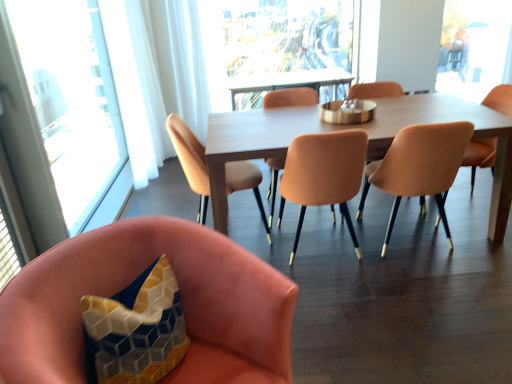
Describe the element at coordinates (71, 99) in the screenshot. I see `transparent glass window at left, the first window from the left` at that location.

What do you see at coordinates (190, 160) in the screenshot? The width and height of the screenshot is (512, 384). I see `matte peach chair at center, the 5th chair when ordered from right to left` at bounding box center [190, 160].

This screenshot has height=384, width=512. What do you see at coordinates (474, 47) in the screenshot? I see `transparent glass window screen at upper right` at bounding box center [474, 47].

Locate an element on the screen. The image size is (512, 384). matte orange chair at center, which is counted as the 3th chair, starting from the left is located at coordinates (291, 98).

At what (x,y) coordinates should I click in order to perform the action: click on transparent glass window at center, which is the 1th window in right-to-left order. Please return your answer as a coordinate pair (x, y). Image resolution: width=512 pixels, height=384 pixels. Looking at the image, I should click on (271, 43).

Image resolution: width=512 pixels, height=384 pixels. I want to click on matte peach armchair at center, so click(x=375, y=90).

Identify the location of transparent glass window at left, positioned as the 2th window in right-to-left order. (71, 99).

Can you tell me how much matte peach chair at center, the 6th chair viewed from the left, and matte peach chair at center, the 5th chair when ordered from right to left, differ in facing direction?

180 degrees.

Would you say matte peach chair at center, which ranks as the 1th chair in right-to-left order, contains matte peach chair at center, the 5th chair when ordered from right to left?

No, matte peach chair at center, which ranks as the 1th chair in right-to-left order, does not contain matte peach chair at center, the 5th chair when ordered from right to left.

Are matte peach chair at center, the 6th chair viewed from the left, and matte peach chair at center, the 5th chair when ordered from right to left, beside each other?

No, matte peach chair at center, the 6th chair viewed from the left, is not beside matte peach chair at center, the 5th chair when ordered from right to left.

Is matte orange chair at center, which appears as the third chair when viewed from the right, with matte orange chair at center, the 4th chair in the right-to-left sequence?

No, matte orange chair at center, which appears as the third chair when viewed from the right, is not in contact with matte orange chair at center, the 4th chair in the right-to-left sequence.

Consider the image. From the image's perspective, is matte orange chair at center, which appears as the third chair when viewed from the right, under matte orange chair at center, which is counted as the 3th chair, starting from the left?

Yes, from the image's perspective, matte orange chair at center, which appears as the third chair when viewed from the right, is below matte orange chair at center, which is counted as the 3th chair, starting from the left.

Between point (347, 161) and point (281, 217), which one is positioned behind?

The point (281, 217) is more distant.

From their relative heights in the image, would you say matte orange chair at center, which appears as the third chair when viewed from the right, is taller or shorter than matte orange chair at center, which is counted as the 3th chair, starting from the left?

Considering their sizes, matte orange chair at center, which appears as the third chair when viewed from the right, has less height than matte orange chair at center, which is counted as the 3th chair, starting from the left.

Can you confirm if transparent glass window screen at upper right is thinner than transparent glass window at center, which ranks as the 2th window in front-to-back order?

Correct, the width of transparent glass window screen at upper right is less than that of transparent glass window at center, which ranks as the 2th window in front-to-back order.

Is point (455, 1) closer to viewer compared to point (261, 77)?

No.

Can you confirm if transparent glass window screen at upper right is positioned to the right of transparent glass window at center, the first window in the back-to-front sequence?

Yes, transparent glass window screen at upper right is to the right of transparent glass window at center, the first window in the back-to-front sequence.

From a real-world perspective, who is located higher, transparent glass window screen at upper right or transparent glass window at center, which ranks as the 2th window in front-to-back order?

From a 3D spatial view, transparent glass window at center, which ranks as the 2th window in front-to-back order, is above.

From a real-world perspective, between matte peach chair at center, which ranks as the 1th chair in right-to-left order, and transparent glass window at center, the first window in the back-to-front sequence, who is vertically lower?

matte peach chair at center, which ranks as the 1th chair in right-to-left order, is physically lower.

Is matte peach chair at center, which ranks as the 1th chair in right-to-left order, outside of transparent glass window at center, the first window in the back-to-front sequence?

Yes, matte peach chair at center, which ranks as the 1th chair in right-to-left order, is outside of transparent glass window at center, the first window in the back-to-front sequence.

Can you confirm if matte peach chair at center, which ranks as the 1th chair in right-to-left order, is smaller than transparent glass window at center, the first window in the back-to-front sequence?

Indeed, matte peach chair at center, which ranks as the 1th chair in right-to-left order, has a smaller size compared to transparent glass window at center, the first window in the back-to-front sequence.

Does matte orange chair at center, which appears as the second chair when viewed from the right, have a lesser width compared to light brown wooden table at center?

Correct, the width of matte orange chair at center, which appears as the second chair when viewed from the right, is less than that of light brown wooden table at center.

From the picture: Which is more to the left, matte orange chair at center, which appears as the second chair when viewed from the right, or light brown wooden table at center?

light brown wooden table at center is more to the left.

Can we say matte orange chair at center, which appears as the second chair when viewed from the right, lies outside light brown wooden table at center?

That's incorrect, matte orange chair at center, which appears as the second chair when viewed from the right, is not completely outside light brown wooden table at center.

Considering the sizes of objects matte orange chair at center, the 4th chair positioned from the left, and matte orange chair at center, which is counted as the fifth chair, starting from the left, in the image provided, who is wider, matte orange chair at center, the 4th chair positioned from the left, or matte orange chair at center, which is counted as the fifth chair, starting from the left,?

matte orange chair at center, the 4th chair positioned from the left.

In terms of size, does matte orange chair at center, which appears as the third chair when viewed from the right, appear bigger or smaller than matte orange chair at center, which is counted as the fifth chair, starting from the left?

Considering their sizes, matte orange chair at center, which appears as the third chair when viewed from the right, takes up less space than matte orange chair at center, which is counted as the fifth chair, starting from the left.

Is matte orange chair at center, which appears as the third chair when viewed from the right, directly adjacent to matte orange chair at center, which appears as the second chair when viewed from the right?

No, matte orange chair at center, which appears as the third chair when viewed from the right, is not beside matte orange chair at center, which appears as the second chair when viewed from the right.

Is matte orange chair at center, which appears as the third chair when viewed from the right, in front of matte orange chair at center, which is counted as the fifth chair, starting from the left?

Yes.

Considering the sizes of objects matte orange chair at center, the 4th chair in the right-to-left sequence, and matte peach armchair at center in the image provided, who is shorter, matte orange chair at center, the 4th chair in the right-to-left sequence, or matte peach armchair at center?

With less height is matte orange chair at center, the 4th chair in the right-to-left sequence.

Where is `chair that is the 1st object located in front of the matte peach armchair at center`? This screenshot has width=512, height=384. chair that is the 1st object located in front of the matte peach armchair at center is located at coordinates click(291, 98).

Is point (271, 189) closer to camera compared to point (367, 161)?

No.

Is matte orange chair at center, which is counted as the 3th chair, starting from the left, at the left side of matte peach armchair at center?

Yes.

From the matte peach chair at center, the 6th chair viewed from the left, count 1st chairs forward and point to it. Please provide its 2D coordinates.

[(190, 160)]

The image size is (512, 384). There is a matte orange chair at center, the 4th chair positioned from the left. Find the location of `the 2nd chair above it (from a real-world perspective)`. the 2nd chair above it (from a real-world perspective) is located at coordinates (291, 98).

When comparing their distances from light brown wooden table at center, does velvet pink chair at lower left, positioned as the 1th chair in left-to-right order, or matte orange chair at center, which appears as the second chair when viewed from the right, seem closer?

Among the two, matte orange chair at center, which appears as the second chair when viewed from the right, is located nearer to light brown wooden table at center.

Estimate the real-world distances between objects in this image. Which object is closer to transparent glass window at left, positioned as the 2th window in right-to-left order, matte orange chair at center, which is counted as the 3th chair, starting from the left, or velvet pink chair at lower left, the 6th chair in the right-to-left sequence?

matte orange chair at center, which is counted as the 3th chair, starting from the left.

Looking at the image, which one is located further to matte orange chair at center, which appears as the third chair when viewed from the right, matte peach armchair at center or transparent glass window screen at upper right?

Answer: transparent glass window screen at upper right is further to matte orange chair at center, which appears as the third chair when viewed from the right.

Estimate the real-world distances between objects in this image. Which object is further from transparent glass window at center, which ranks as the 2th window in front-to-back order, velvet pink chair at lower left, the 6th chair in the right-to-left sequence, or matte peach armchair at center?

Among the two, velvet pink chair at lower left, the 6th chair in the right-to-left sequence, is located further to transparent glass window at center, which ranks as the 2th window in front-to-back order.

Based on their spatial positions, is matte orange chair at center, which appears as the third chair when viewed from the right, or matte peach chair at center, which ranks as the 1th chair in right-to-left order, closer to matte peach armchair at center?

Based on the image, matte peach chair at center, which ranks as the 1th chair in right-to-left order, appears to be nearer to matte peach armchair at center.

Estimate the real-world distances between objects in this image. Which object is closer to matte peach chair at center, the 6th chair viewed from the left, transparent glass window at center, which ranks as the 2th window in front-to-back order, or matte orange chair at center, which is counted as the 3th chair, starting from the left?

matte orange chair at center, which is counted as the 3th chair, starting from the left, is positioned closer to the anchor matte peach chair at center, the 6th chair viewed from the left.

Estimate the real-world distances between objects in this image. Which object is closer to matte orange chair at center, which is counted as the 3th chair, starting from the left, matte peach armchair at center or matte peach chair at center, which ranks as the 1th chair in right-to-left order?

matte peach armchair at center is positioned closer to the anchor matte orange chair at center, which is counted as the 3th chair, starting from the left.

From the image, which object appears to be nearer to matte orange chair at center, which appears as the second chair when viewed from the right, matte peach chair at center, the 5th chair when ordered from right to left, or transparent glass window at left, the second window positioned from the back?

matte peach chair at center, the 5th chair when ordered from right to left, is positioned closer to the anchor matte orange chair at center, which appears as the second chair when viewed from the right.

This screenshot has width=512, height=384. I want to click on kitchen & dining room table between matte orange chair at center, which appears as the third chair when viewed from the right, and transparent glass window at center, which ranks as the 2th window in front-to-back order, in the front-back direction, so click(349, 128).

The width and height of the screenshot is (512, 384). In order to click on armchair between velvet pink chair at lower left, the 6th chair in the right-to-left sequence, and transparent glass window at center, which is the 1th window in right-to-left order, along the z-axis in this screenshot , I will do `click(375, 90)`.

Where is `kitchen & dining room table between velvet pink chair at lower left, positioned as the 1th chair in left-to-right order, and matte peach chair at center, the 5th chair when ordered from right to left, in the front-back direction`? kitchen & dining room table between velvet pink chair at lower left, positioned as the 1th chair in left-to-right order, and matte peach chair at center, the 5th chair when ordered from right to left, in the front-back direction is located at coordinates point(349,128).

Identify the location of kitchen & dining room table between matte orange chair at center, the 4th chair positioned from the left, and matte peach armchair at center. (349, 128).